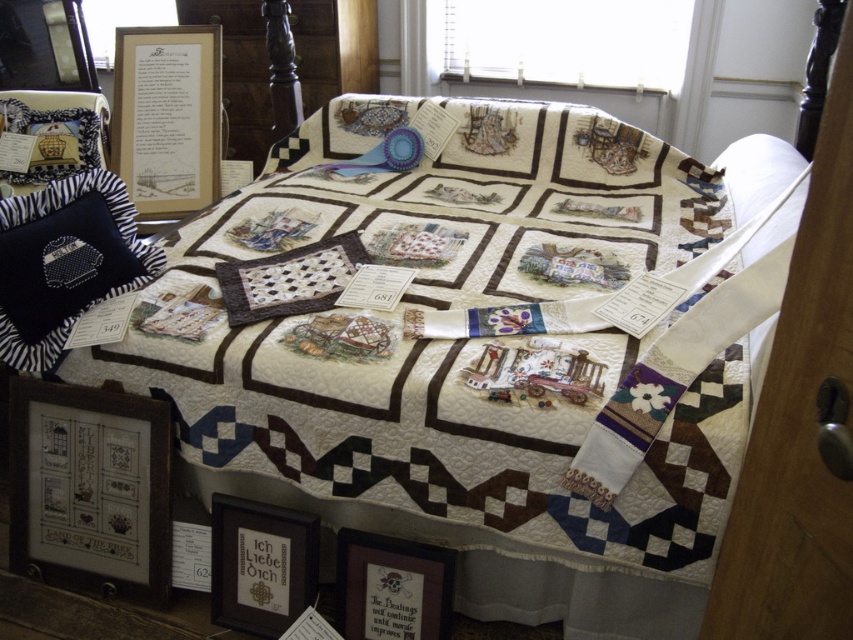
Does matte gold picture frame at upper left have a greater height compared to matte black picture frame at lower center?

Indeed, matte gold picture frame at upper left has a greater height compared to matte black picture frame at lower center.

Is point (163, 83) closer to viewer compared to point (271, 589)?

No, it is behind (271, 589).

The width and height of the screenshot is (853, 640). Find the location of `matte gold picture frame at upper left`. matte gold picture frame at upper left is located at coordinates (167, 116).

At what (x,y) coordinates should I click in order to perform the action: click on matte gold picture frame at upper left. Please return your answer as a coordinate pair (x, y). The width and height of the screenshot is (853, 640). Looking at the image, I should click on (167, 116).

Between point (165, 168) and point (390, 580), which one is positioned in front?

Point (390, 580) is more forward.

Between point (178, 33) and point (405, 556), which one is positioned behind?

Point (178, 33)

Identify the location of matte gold picture frame at upper left. The height and width of the screenshot is (640, 853). (x=167, y=116).

Which is behind, point (109, 412) or point (381, 570)?

The point (109, 412) is more distant.

Is wooden framed picture at lower left shorter than wooden framed sign at lower center?

In fact, wooden framed picture at lower left may be taller than wooden framed sign at lower center.

The width and height of the screenshot is (853, 640). What are the coordinates of `wooden framed picture at lower left` in the screenshot? It's located at (90, 488).